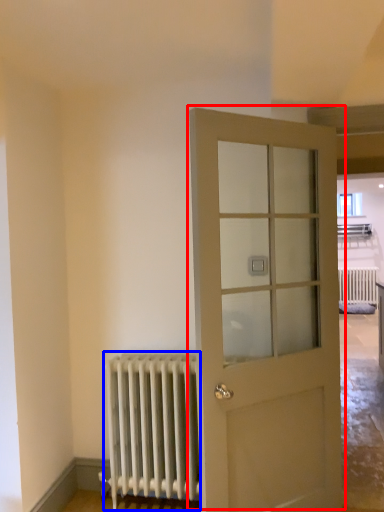
Question: Which of the following is the farthest to the observer, door (highlighted by a red box) or radiator (highlighted by a blue box)?

Choices:
 (A) door
 (B) radiator

Answer: (B)